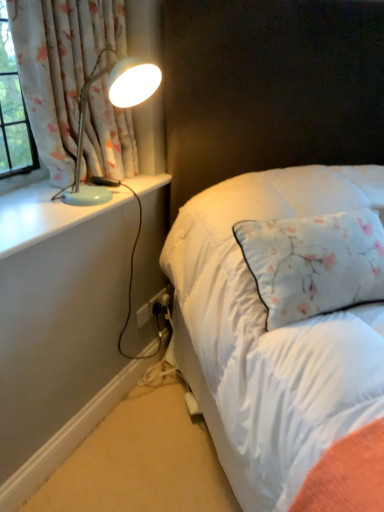
Describe the element at coordinates (61, 67) in the screenshot. I see `floral fabric curtain at upper left` at that location.

Where is `white matte power strip at lower center`? The width and height of the screenshot is (384, 512). white matte power strip at lower center is located at coordinates (59, 326).

Describe the element at coordinates (270, 86) in the screenshot. I see `white quilted bed at center` at that location.

Locate an element on the screen. This screenshot has height=512, width=384. floral fabric curtain at upper left is located at coordinates (61, 67).

Considering the relative sizes of floral fabric curtain at upper left and white glossy window sill at left in the image provided, is floral fabric curtain at upper left smaller than white glossy window sill at left?

No.

From a real-world perspective, is floral fabric curtain at upper left above or below white glossy window sill at left?

From a real-world perspective, floral fabric curtain at upper left is physically above white glossy window sill at left.

Is point (35, 66) closer to viewer compared to point (155, 183)?

That is True.

Is floral fabric curtain at upper left further to the viewer compared to white glossy window sill at left?

Yes, the depth of floral fabric curtain at upper left is greater than that of white glossy window sill at left.

Which is more distant, (290,20) or (152,302)?

The point (152,302) is farther from the camera.

Who is taller, white quilted bed at center or black plastic electric outlet at lower center?

white quilted bed at center is taller.

From the image's perspective, which one is positioned higher, white quilted bed at center or black plastic electric outlet at lower center?

white quilted bed at center, from the image's perspective.

Considering the sizes of objects white quilted bed at center and black plastic electric outlet at lower center in the image provided, who is smaller, white quilted bed at center or black plastic electric outlet at lower center?

black plastic electric outlet at lower center is smaller.

Does white matte power strip at lower center turn towards floral fabric curtain at upper left?

No, white matte power strip at lower center is not aimed at floral fabric curtain at upper left.

Is point (40, 270) farther from camera compared to point (77, 106)?

No, it is in front of (77, 106).

Considering the relative positions of white matte power strip at lower center and floral fabric curtain at upper left in the image provided, is white matte power strip at lower center to the left or to the right of floral fabric curtain at upper left?

Based on their positions, white matte power strip at lower center is located to the right of floral fabric curtain at upper left.

Can you tell me how much white matte power strip at lower center and floral fabric curtain at upper left differ in facing direction?

The angular difference between white matte power strip at lower center and floral fabric curtain at upper left is 0.0114 degrees.

Is black plastic electric outlet at lower center to the left of floral fabric curtain at upper left from the viewer's perspective?

No.

Consider the image. Considering the sizes of objects black plastic electric outlet at lower center and floral fabric curtain at upper left in the image provided, who is smaller, black plastic electric outlet at lower center or floral fabric curtain at upper left?

black plastic electric outlet at lower center.

Could you tell me if black plastic electric outlet at lower center is facing floral fabric curtain at upper left?

No, black plastic electric outlet at lower center is not facing towards floral fabric curtain at upper left.

From a real-world perspective, relative to floral fabric curtain at upper left, is black plastic electric outlet at lower center vertically above or below?

In terms of real-world spatial position, black plastic electric outlet at lower center is below floral fabric curtain at upper left.

Which of these two, white glossy window sill at left or floral fabric curtain at upper left, stands taller?

floral fabric curtain at upper left.

Is white glossy window sill at left to the left or to the right of floral fabric curtain at upper left in the image?

Clearly, white glossy window sill at left is on the left of floral fabric curtain at upper left in the image.

Is white glossy window sill at left positioned beyond the bounds of floral fabric curtain at upper left?

Yes, white glossy window sill at left is not within floral fabric curtain at upper left.

Based on the photo, which point is more forward, (9,217) or (118,128)?

The point (9,217) is closer.

Considering the sizes of objects white matte power strip at lower center and matte blue lamp at left in the image provided, who is bigger, white matte power strip at lower center or matte blue lamp at left?

matte blue lamp at left.

Is white matte power strip at lower center facing towards matte blue lamp at left?

No, white matte power strip at lower center is not aimed at matte blue lamp at left.

In the image, is white matte power strip at lower center on the left side or the right side of matte blue lamp at left?

From the image, it's evident that white matte power strip at lower center is to the left of matte blue lamp at left.

Is white matte power strip at lower center not inside matte blue lamp at left?

white matte power strip at lower center is positioned outside matte blue lamp at left.

Is white quilted bed at center not close to matte blue lamp at left?

Actually, white quilted bed at center and matte blue lamp at left are a little close together.

Considering the sizes of objects white quilted bed at center and matte blue lamp at left in the image provided, who is smaller, white quilted bed at center or matte blue lamp at left?

Smaller between the two is matte blue lamp at left.

Considering the positions of objects white quilted bed at center and matte blue lamp at left in the image provided, who is more to the right, white quilted bed at center or matte blue lamp at left?

white quilted bed at center is more to the right.

From the image's perspective, is white quilted bed at center beneath matte blue lamp at left?

Yes.

Where is `window sill located below the floral fabric curtain at upper left (from the image's perspective)`? window sill located below the floral fabric curtain at upper left (from the image's perspective) is located at coordinates (43, 215).

This screenshot has height=512, width=384. There is a black plastic electric outlet at lower center. Find the location of `bed above it (from a real-world perspective)`. bed above it (from a real-world perspective) is located at coordinates (270, 86).

From the image, which object appears to be nearer to white quilted bed at center, matte blue lamp at left or white glossy window sill at left?

matte blue lamp at left is positioned closer to the anchor white quilted bed at center.

Which object lies further to the anchor point white matte power strip at lower center, floral fabric curtain at upper left or white glossy window sill at left?

Based on the image, floral fabric curtain at upper left appears to be further to white matte power strip at lower center.

Based on their spatial positions, is white matte power strip at lower center or floral fabric curtain at upper left closer to black plastic electric outlet at lower center?

Based on the image, white matte power strip at lower center appears to be nearer to black plastic electric outlet at lower center.

Estimate the real-world distances between objects in this image. Which object is closer to matte blue lamp at left, black plastic electric outlet at lower center or white glossy window sill at left?

Among the two, white glossy window sill at left is located nearer to matte blue lamp at left.

From the image, which object appears to be nearer to white quilted bed at center, white matte power strip at lower center or matte blue lamp at left?

The object closer to white quilted bed at center is matte blue lamp at left.

When comparing their distances from white glossy window sill at left, does white matte power strip at lower center or black plastic electric outlet at lower center seem further?

The object further to white glossy window sill at left is black plastic electric outlet at lower center.

Which object lies nearer to the anchor point white quilted bed at center, black plastic electric outlet at lower center or matte blue lamp at left?

matte blue lamp at left is positioned closer to the anchor white quilted bed at center.

Considering their positions, is floral fabric curtain at upper left positioned closer to white quilted bed at center than black plastic electric outlet at lower center?

Among the two, floral fabric curtain at upper left is located nearer to white quilted bed at center.

Where is `dresser between white quilted bed at center and black plastic electric outlet at lower center in the front-back direction`? dresser between white quilted bed at center and black plastic electric outlet at lower center in the front-back direction is located at coordinates (59, 326).

Image resolution: width=384 pixels, height=512 pixels. I want to click on window sill between white quilted bed at center and white matte power strip at lower center in the front-back direction, so click(43, 215).

In order to click on lamp located between white glossy window sill at left and white quilted bed at center in the left-right direction in this screenshot , I will do `click(116, 106)`.

This screenshot has height=512, width=384. I want to click on window sill between floral fabric curtain at upper left and white matte power strip at lower center in the vertical direction, so click(43, 215).